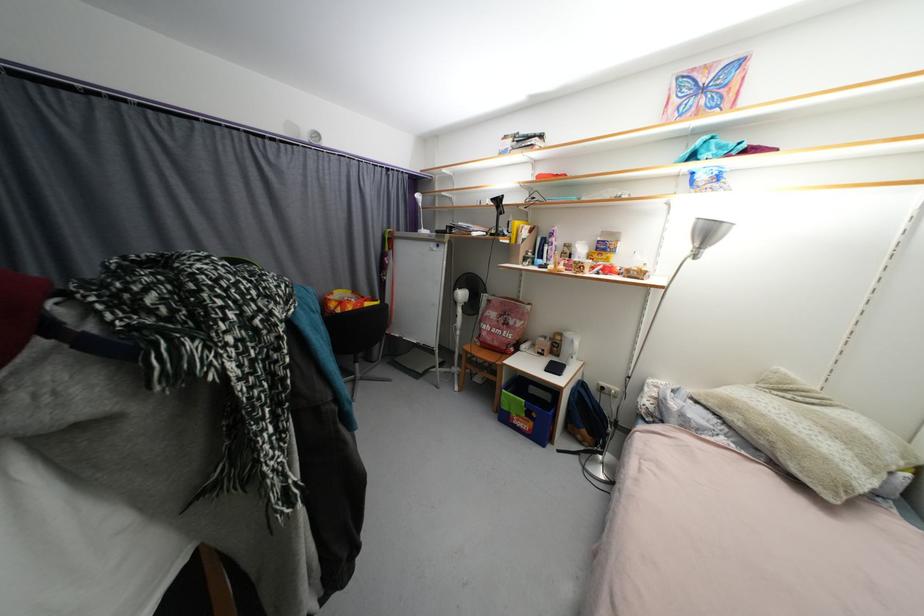
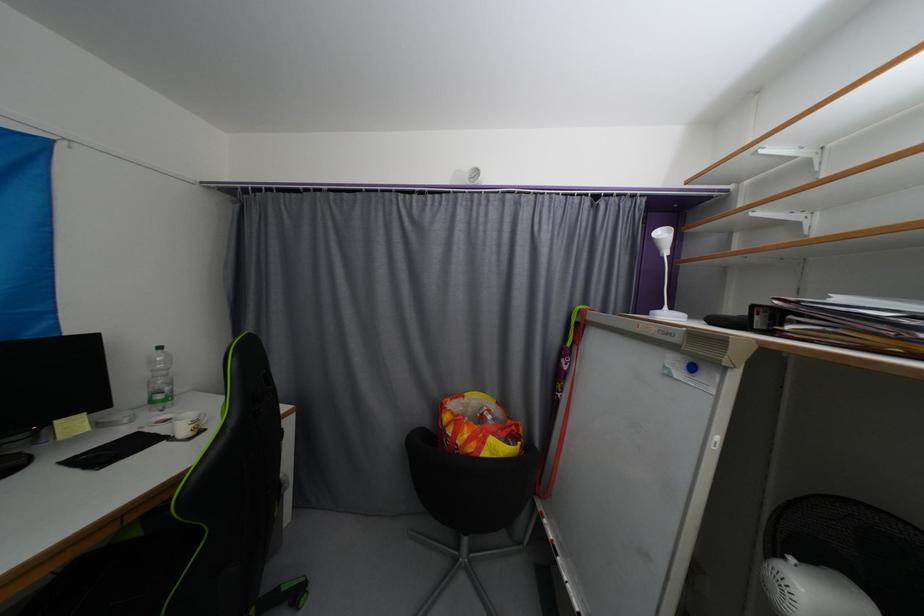
Where in the second image is the point corresponding to (337,307) from the first image?

(452, 419)